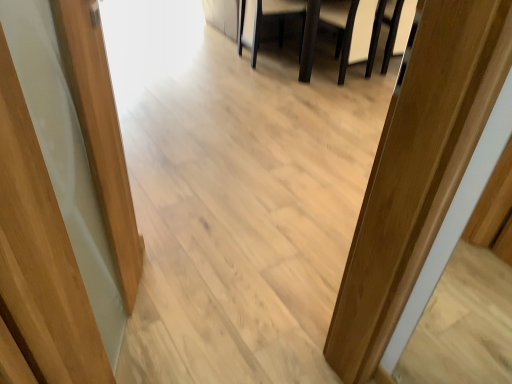
I want to click on vacant area that lies in front of white leather armchair at upper center, which ranks as the second armchair in left-to-right order, so click(337, 100).